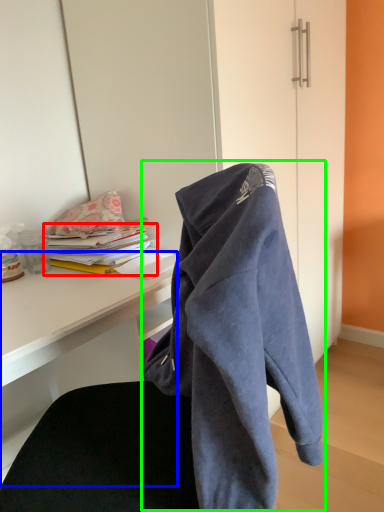
Question: Which object is the closest to the book (highlighted by a red box)? Choose among these: desk (highlighted by a blue box) or bath towel (highlighted by a green box).

Choices:
 (A) desk
 (B) bath towel

Answer: (A)